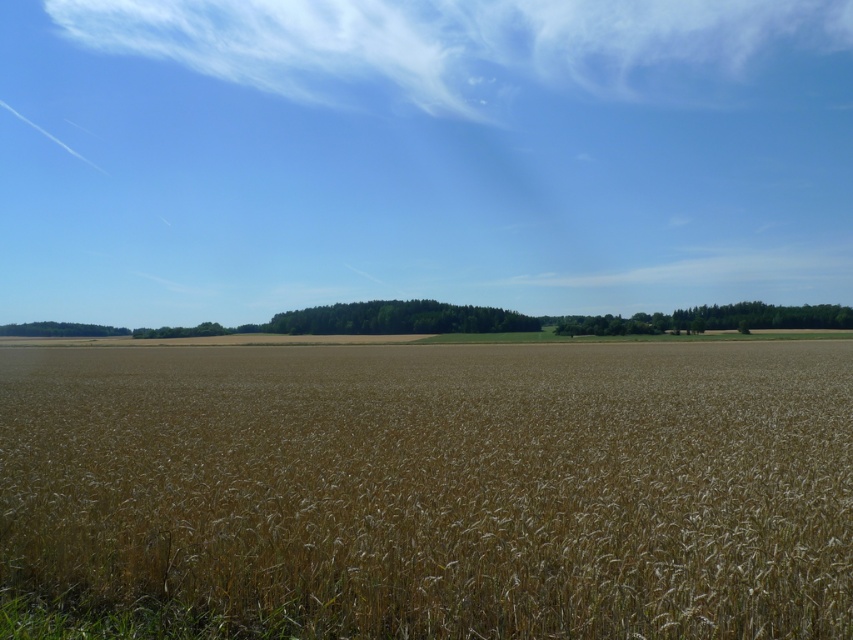
In the scene shown: You are a drone operator trying to capture the best aerial shot of the agricultural landscape. The transparent blue sky at upper center is crucial for the composition. Based on its position, what coordinates should you aim for to center the sky in your shot?

The transparent blue sky at upper center is located at coordinates point (421, 156), so you should aim for those coordinates to center it in your shot.

You are a farmer checking the weather conditions from your tractor. You notice the transparent blue sky at upper center and the brown grainy wheat field at center. Which area would you estimate has a wider horizontal span from your viewpoint?

The transparent blue sky at upper center might be wider than brown grainy wheat field at center according to the description.

You are a farmer checking the weather conditions. You notice the transparent blue sky at upper center and the brown grainy wheat field at center. Which object is positioned higher in the image?

The transparent blue sky at upper center is located above the brown grainy wheat field at center, so it is positioned higher in the image.